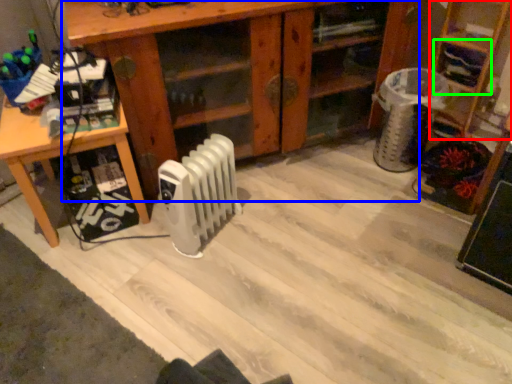
Question: Which is farther away from shelf (highlighted by a red box)? shelf (highlighted by a blue box) or shelf (highlighted by a green box)?

Choices:
 (A) shelf
 (B) shelf

Answer: (A)